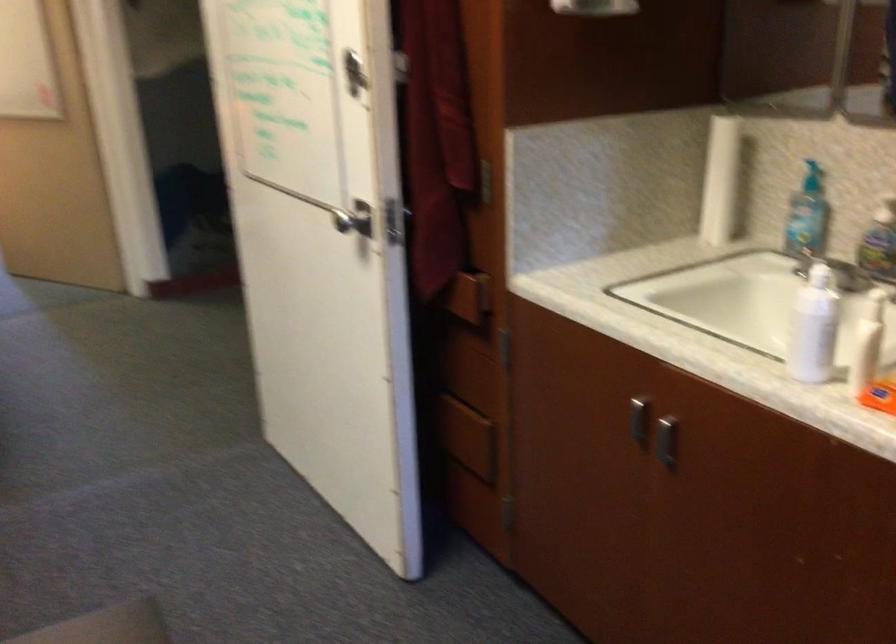
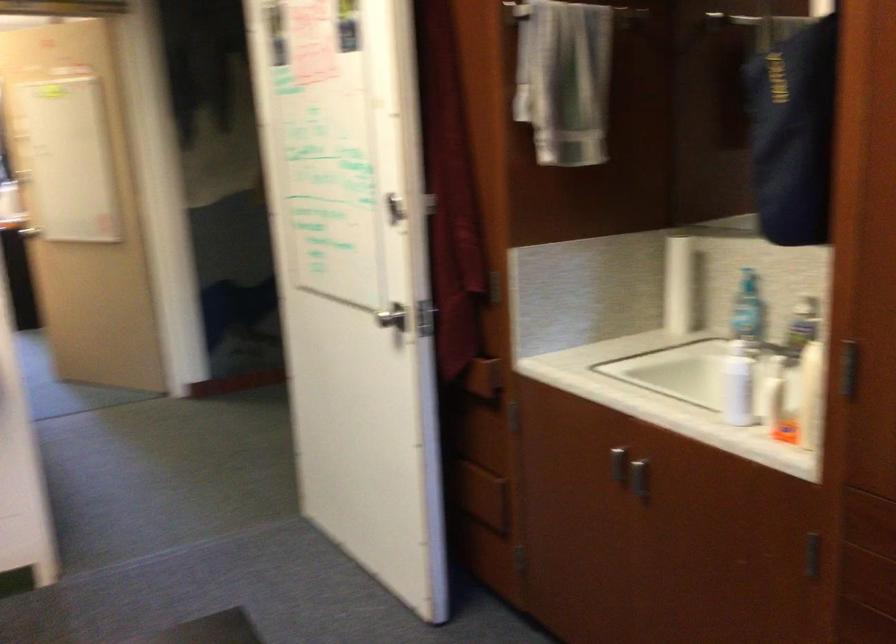
Find the pixel in the second image that matches point 815,330 in the first image.

(737, 384)